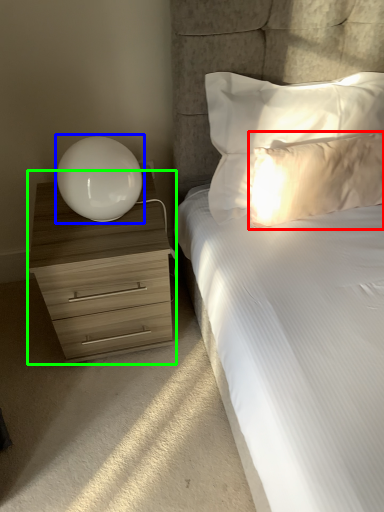
Question: Estimate the real-world distances between objects in this image. Which object is farther from pillow (highlighted by a red box), table lamp (highlighted by a blue box) or chest of drawers (highlighted by a green box)?

Choices:
 (A) table lamp
 (B) chest of drawers

Answer: (B)